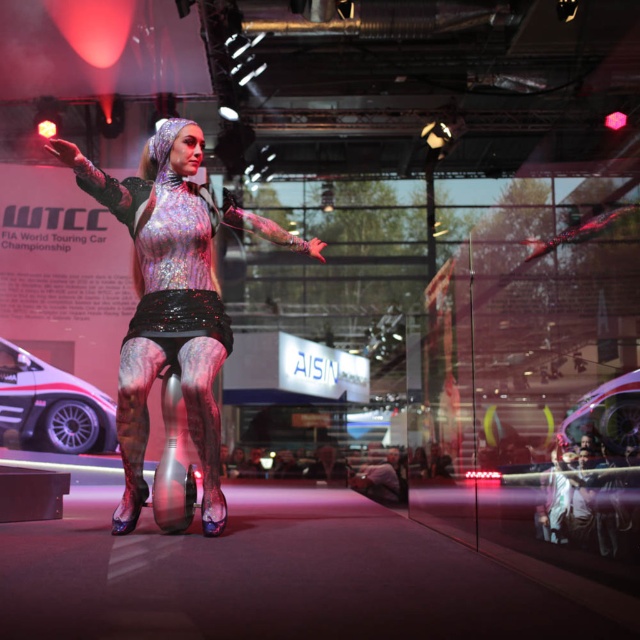
Does shiny metallic bodysuit at center have a greater width compared to white glossy car at left?

No, shiny metallic bodysuit at center is not wider than white glossy car at left.

Is shiny metallic bodysuit at center closer to camera compared to white glossy car at left?

Yes, shiny metallic bodysuit at center is in front of white glossy car at left.

This screenshot has width=640, height=640. Find the location of `shiny metallic bodysuit at center`. shiny metallic bodysuit at center is located at coordinates (172, 300).